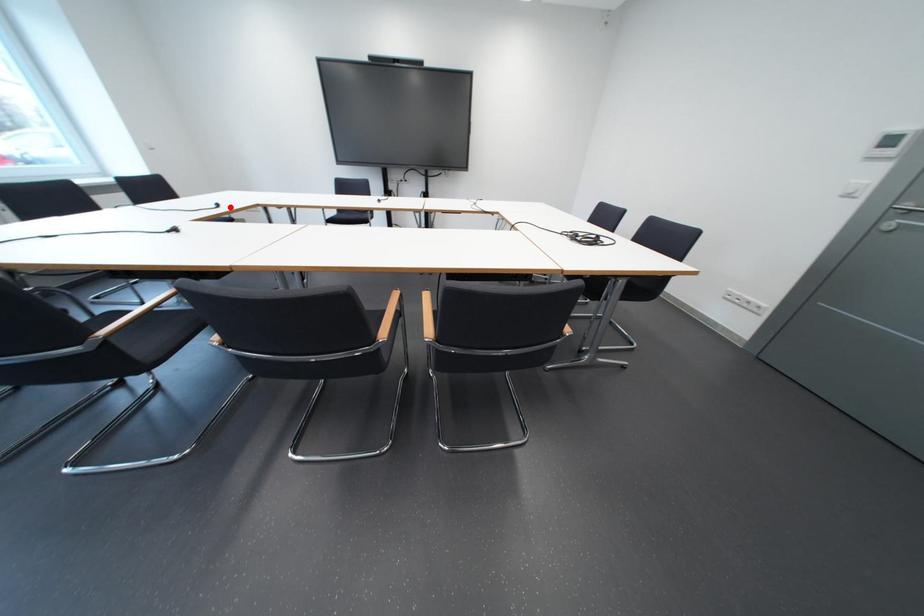
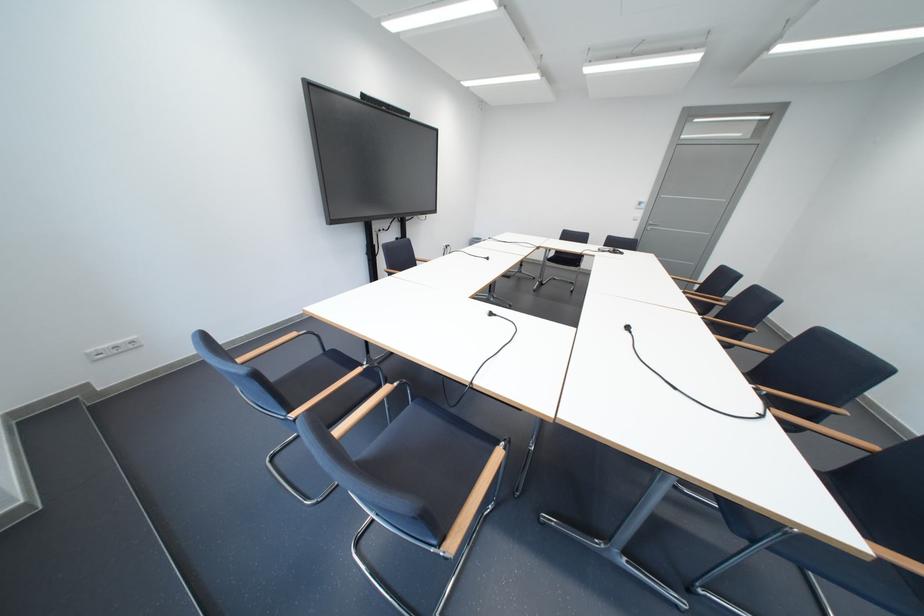
Question: I am providing you with two images of the same scene from different viewpoints. A red point is shown in image1. For the corresponding object point in image2, is it positioned nearer or farther from the camera?

Choices:
 (A) Nearer
 (B) Farther

Answer: (B)